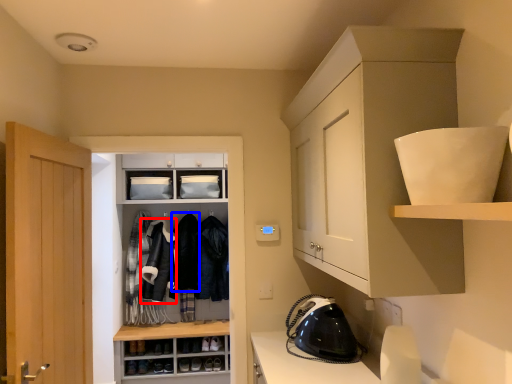
Question: Which of the following is the farthest to the observer, clothing (highlighted by a red box) or clothing (highlighted by a blue box)?

Choices:
 (A) clothing
 (B) clothing

Answer: (B)